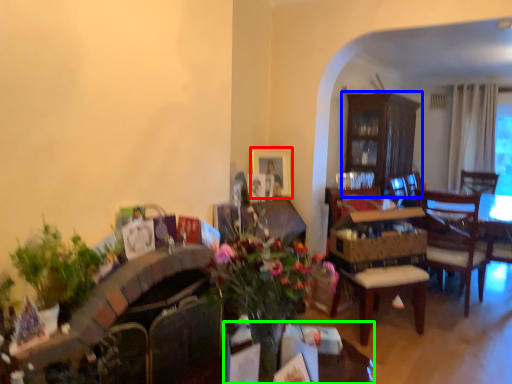
Question: Considering the real-world distances, which object is closest to picture frame (highlighted by a red box)? cabinetry (highlighted by a blue box) or table (highlighted by a green box).

Choices:
 (A) cabinetry
 (B) table

Answer: (B)